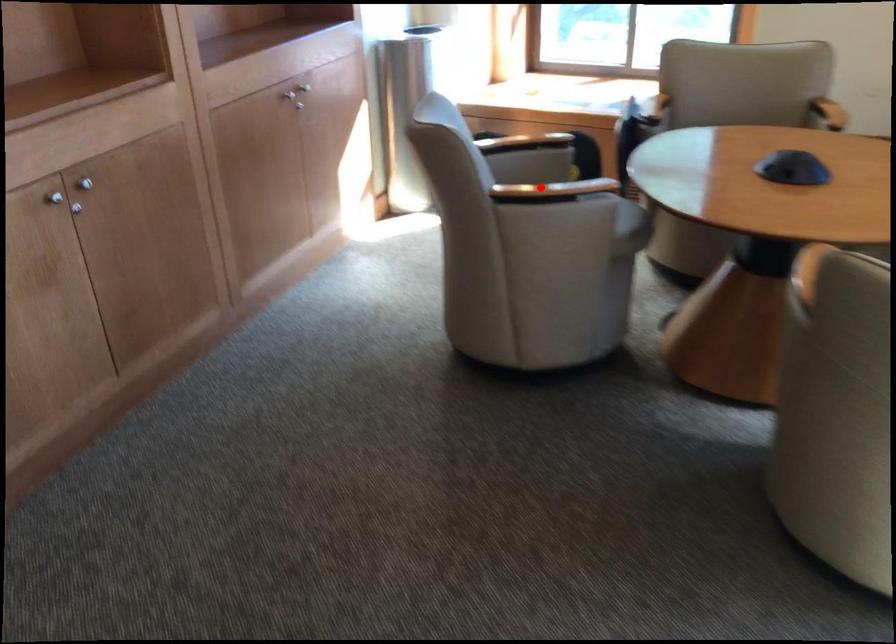
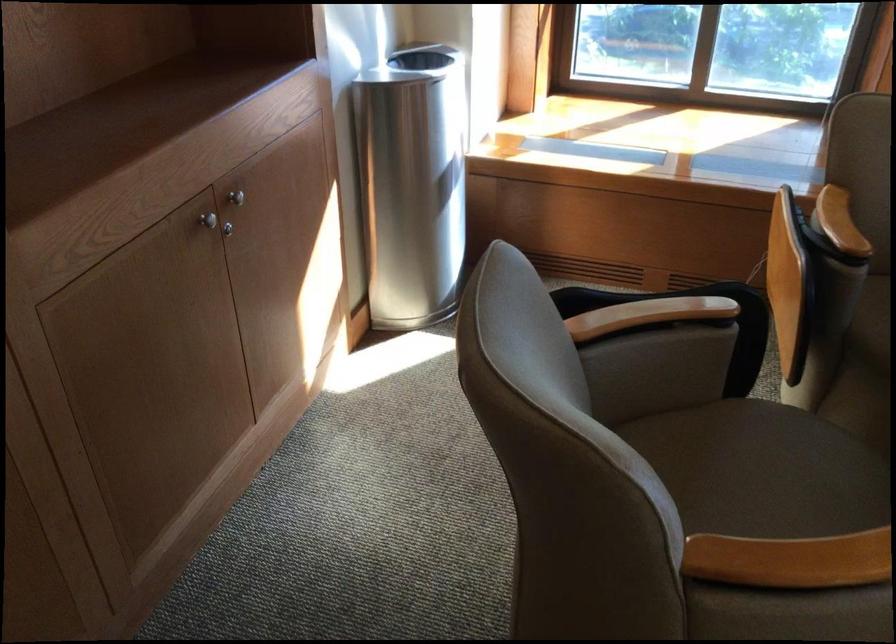
Question: I am providing you with two images of the same scene from different viewpoints. In image1, a red point is highlighted. Considering the same 3D point in image2, which of the following is correct?

Choices:
 (A) It is closer
 (B) It is farther

Answer: (A)